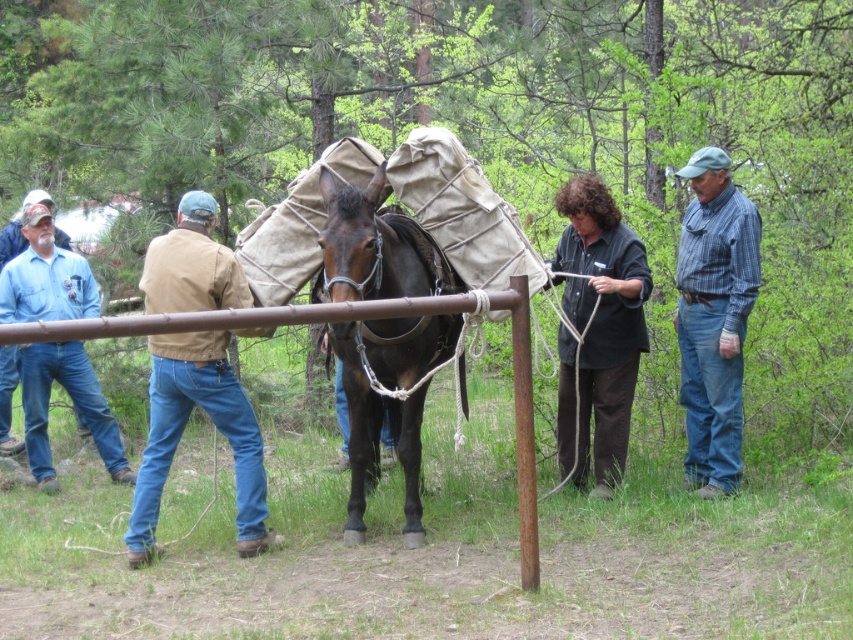
Can you confirm if black matte shirt at center is positioned to the left of blue denim jeans at left?

Incorrect, black matte shirt at center is not on the left side of blue denim jeans at left.

Between black matte shirt at center and blue denim jeans at left, which one is positioned higher?

black matte shirt at center is higher up.

Where is `black matte shirt at center`? The height and width of the screenshot is (640, 853). black matte shirt at center is located at coordinates (602, 321).

Does point (701, 285) come in front of point (26, 433)?

Yes, it is in front of point (26, 433).

Does blue plaid shirt at center right appear on the left side of blue denim jeans at left?

No, blue plaid shirt at center right is not to the left of blue denim jeans at left.

This screenshot has width=853, height=640. Find the location of `blue plaid shirt at center right`. blue plaid shirt at center right is located at coordinates (714, 317).

Can you confirm if black matte shirt at center is positioned below blue plaid shirt at center right?

Correct, black matte shirt at center is located below blue plaid shirt at center right.

Is black matte shirt at center to the left of blue plaid shirt at center right from the viewer's perspective?

Yes, black matte shirt at center is to the left of blue plaid shirt at center right.

Is point (628, 349) positioned in front of point (733, 378)?

No, (628, 349) is behind (733, 378).

Locate an element on the screen. The height and width of the screenshot is (640, 853). black matte shirt at center is located at coordinates (602, 321).